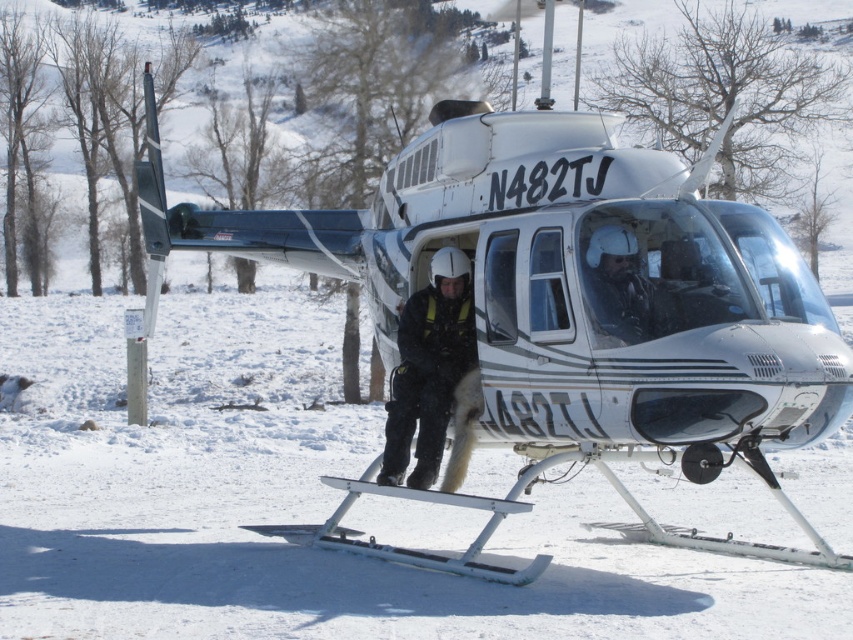
Is white glossy helicopter at center thinner than black matte uniform at center?

Yes, white glossy helicopter at center is thinner than black matte uniform at center.

Which is behind, point (486, 128) or point (424, 300)?

Point (424, 300)

At what (x,y) coordinates should I click in order to perform the action: click on white glossy helicopter at center. Please return your answer as a coordinate pair (x, y). The image size is (853, 640). Looking at the image, I should click on (561, 310).

Measure the distance between white glossy helicopter at center and matte black helmet at center.

white glossy helicopter at center is 5.16 feet from matte black helmet at center.

Is white glossy helicopter at center to the right of matte black helmet at center from the viewer's perspective?

In fact, white glossy helicopter at center is to the left of matte black helmet at center.

Locate an element on the screen. white glossy helicopter at center is located at coordinates pyautogui.click(x=561, y=310).

Where is `white glossy helicopter at center`? This screenshot has width=853, height=640. white glossy helicopter at center is located at coordinates (561, 310).

Who is positioned more to the left, black matte uniform at center or matte black helmet at center?

Positioned to the left is black matte uniform at center.

What do you see at coordinates (428, 369) in the screenshot?
I see `black matte uniform at center` at bounding box center [428, 369].

The image size is (853, 640). What are the coordinates of `black matte uniform at center` in the screenshot? It's located at (428, 369).